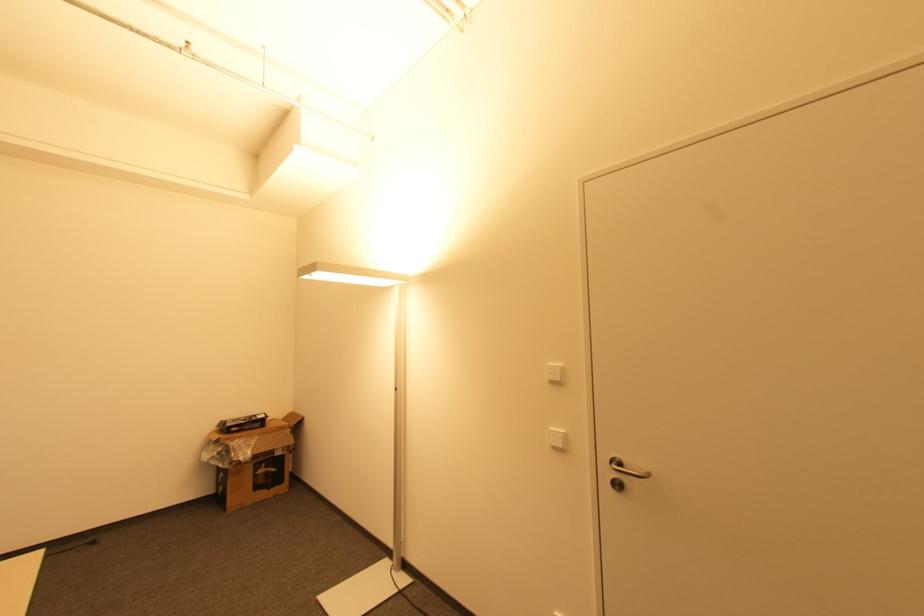
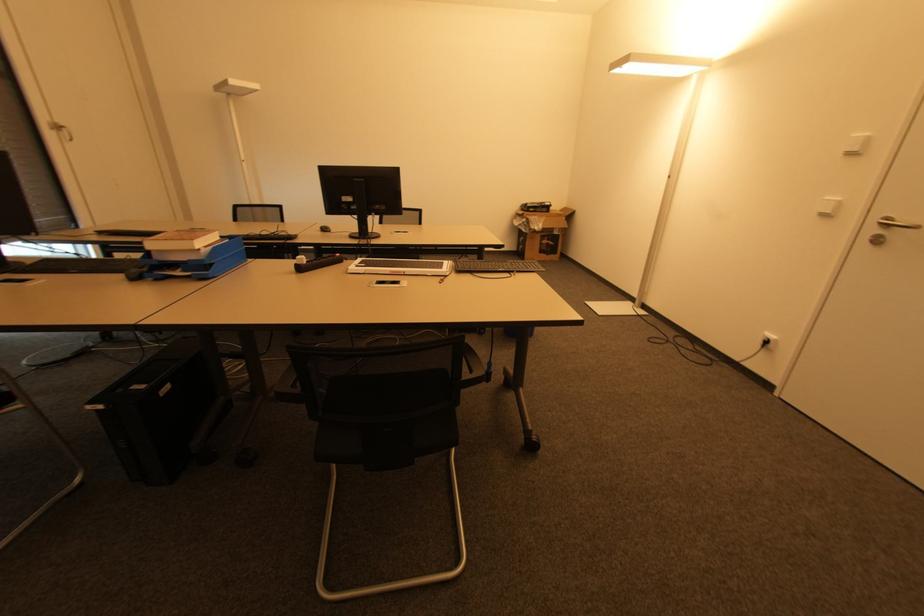
Locate, in the second image, the point that corresponds to pixel 563 446 in the first image.

(832, 214)